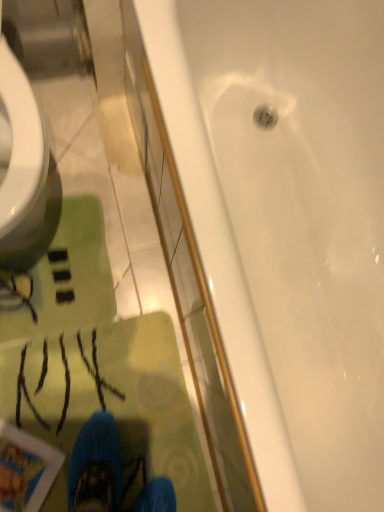
What do you see at coordinates (288, 225) in the screenshot?
I see `white glossy bathtub at center` at bounding box center [288, 225].

In order to face white glossy bathtub at center, should I rotate leftwards or rightwards?

Rotate right and turn 17.508 degrees.

Locate an element on the screen. The width and height of the screenshot is (384, 512). white glossy bathtub at center is located at coordinates tap(288, 225).

Locate an element on the screen. white glossy bathtub at center is located at coordinates (288, 225).